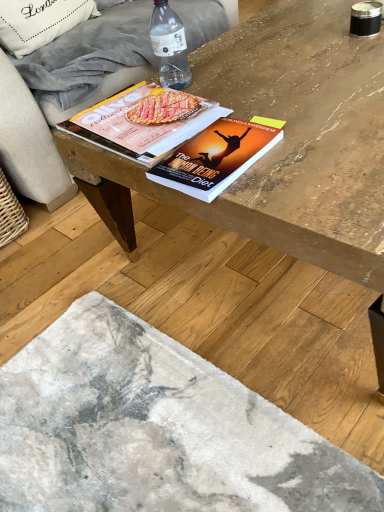
Question: Would you say hardcover book at center, arranged as the 1th book when viewed from the front, is outside beige fabric couch at upper left?

Choices:
 (A) no
 (B) yes

Answer: (B)

Question: Does hardcover book at center, arranged as the 1th book when viewed from the front, contain beige fabric couch at upper left?

Choices:
 (A) yes
 (B) no

Answer: (B)

Question: Does hardcover book at center, acting as the second book starting from the back, lie behind beige fabric couch at upper left?

Choices:
 (A) yes
 (B) no

Answer: (B)

Question: Considering the relative positions of hardcover book at center, arranged as the 1th book when viewed from the front, and beige fabric couch at upper left in the image provided, is hardcover book at center, arranged as the 1th book when viewed from the front, in front of beige fabric couch at upper left?

Choices:
 (A) yes
 (B) no

Answer: (A)

Question: Could you tell me if hardcover book at center, acting as the second book starting from the back, is facing beige fabric couch at upper left?

Choices:
 (A) no
 (B) yes

Answer: (A)

Question: Is hardcover book at center, arranged as the 1th book when viewed from the front, wider than beige fabric couch at upper left?

Choices:
 (A) no
 (B) yes

Answer: (A)

Question: From a real-world perspective, is wooden table at center on matte paper magazine at center, which is the 2th book from front to back?

Choices:
 (A) no
 (B) yes

Answer: (A)

Question: From the image's perspective, does wooden table at center appear lower than matte paper magazine at center, which is the 2th book from front to back?

Choices:
 (A) no
 (B) yes

Answer: (B)

Question: Is wooden table at center further to camera compared to matte paper magazine at center, marked as the first book in a back-to-front arrangement?

Choices:
 (A) no
 (B) yes

Answer: (A)

Question: Does wooden table at center have a greater height compared to matte paper magazine at center, which is the 2th book from front to back?

Choices:
 (A) yes
 (B) no

Answer: (A)

Question: Can you confirm if wooden table at center is shorter than matte paper magazine at center, marked as the first book in a back-to-front arrangement?

Choices:
 (A) no
 (B) yes

Answer: (A)

Question: From the image's perspective, is wooden table at center on top of matte paper magazine at center, which is the 2th book from front to back?

Choices:
 (A) no
 (B) yes

Answer: (A)

Question: Can you confirm if white fabric pillow at upper left is positioned to the right of matte paper magazine at center, which is the 2th book from front to back?

Choices:
 (A) no
 (B) yes

Answer: (A)